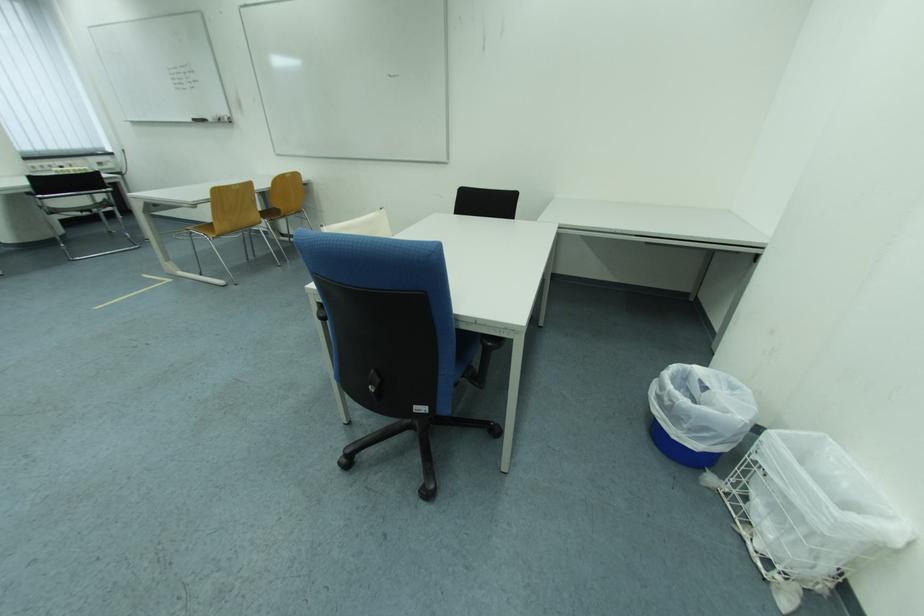
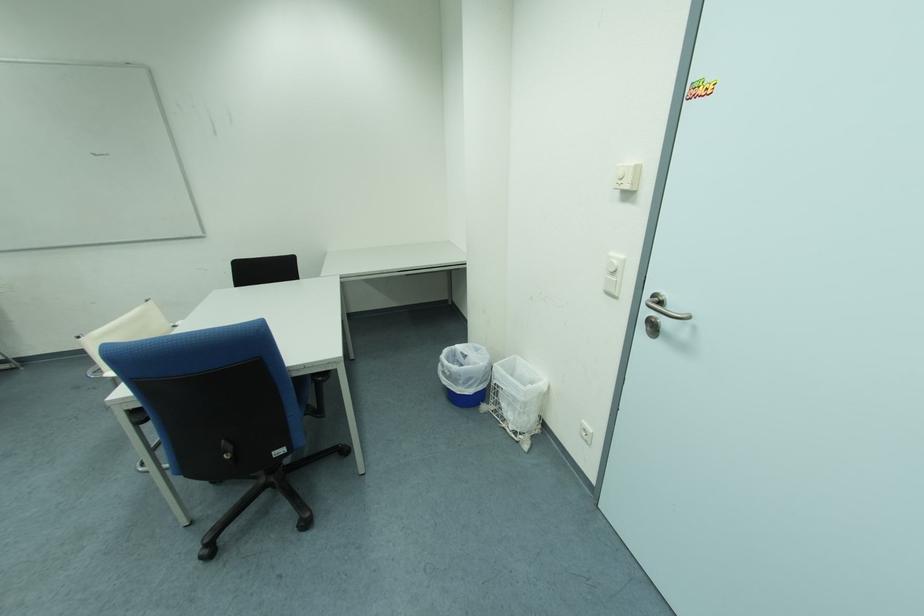
The point at [382,373] is marked in the first image. Where is the corresponding point in the second image?

(232, 444)